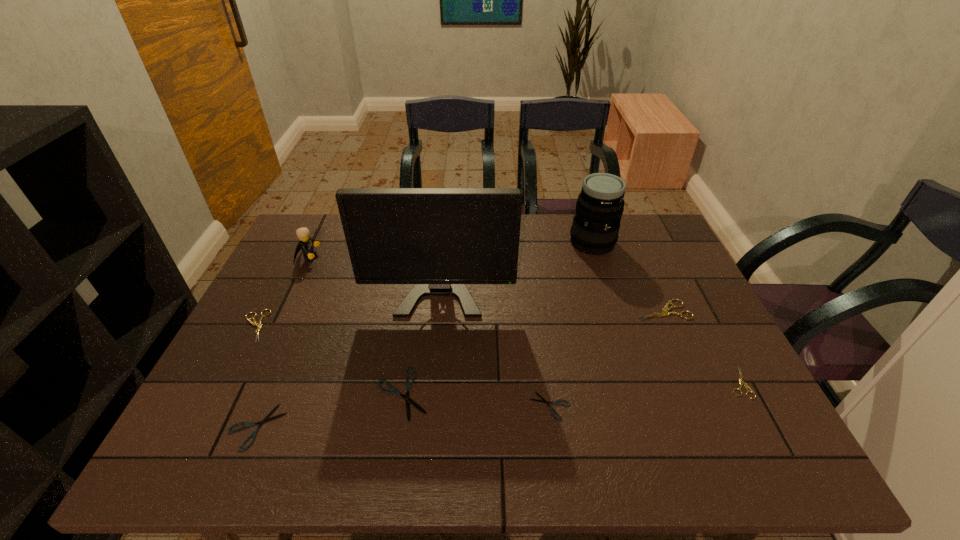
Where is `black shears that is the closest to the nearest beige shears`? The width and height of the screenshot is (960, 540). black shears that is the closest to the nearest beige shears is located at coordinates (544, 401).

This screenshot has height=540, width=960. What are the coordinates of `free region that satisfies the following two spatial constraints: 1. on the back side of the fourth tallest object; 2. on the right side of the second black shears from left to right` in the screenshot? It's located at (416, 310).

Locate an element on the screen. The height and width of the screenshot is (540, 960). free space that satisfies the following two spatial constraints: 1. on the front-facing side of the Lego; 2. on the left side of the rightmost black shears is located at coordinates (239, 406).

Image resolution: width=960 pixels, height=540 pixels. What are the coordinates of `vacant region that satisfies the following two spatial constraints: 1. on the front-facing side of the fourth shears from right to left; 2. on the right side of the seventh shortest object` in the screenshot? It's located at (245, 394).

Where is `vacant space that satisfies the following two spatial constraints: 1. on the front-facing side of the seventh shortest object; 2. on the right side of the shortest object`? vacant space that satisfies the following two spatial constraints: 1. on the front-facing side of the seventh shortest object; 2. on the right side of the shortest object is located at coordinates (239, 406).

In order to click on free spot that satisfies the following two spatial constraints: 1. on the back side of the rightmost shears; 2. on the left side of the rightmost black shears in this screenshot , I will do `click(547, 383)`.